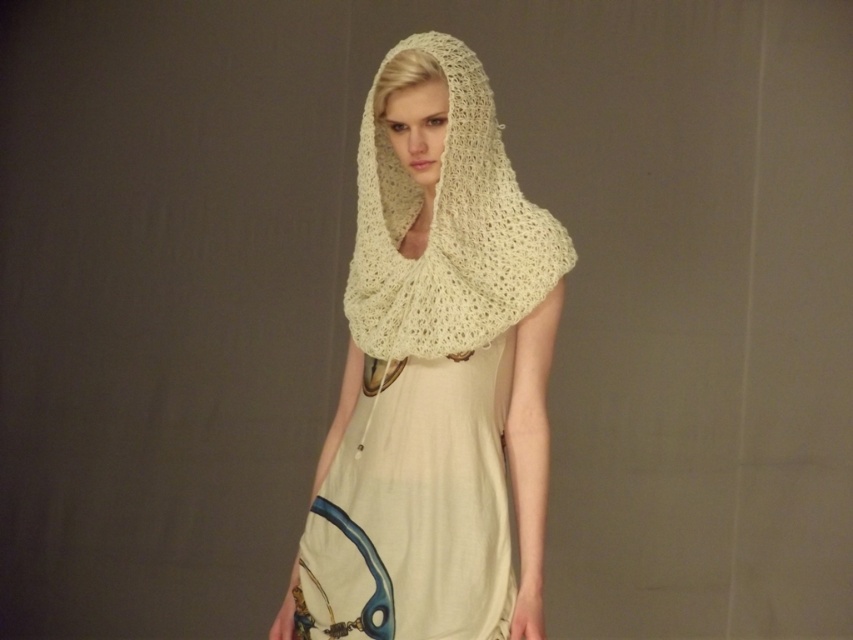
Question: Which object is farther from the camera taking this photo?

Choices:
 (A) ivory knitted shawl at center
 (B) light beige cotton dress at center
 (C) creamy knit shawl at center

Answer: (B)

Question: Can you confirm if ivory knitted shawl at center is bigger than creamy knit shawl at center?

Choices:
 (A) no
 (B) yes

Answer: (B)

Question: Which object is positioned farthest from the ivory knitted shawl at center?

Choices:
 (A) light beige cotton dress at center
 (B) creamy knit shawl at center

Answer: (B)

Question: Can you confirm if ivory knitted shawl at center is positioned below light beige cotton dress at center?

Choices:
 (A) no
 (B) yes

Answer: (A)

Question: Which of the following is the farthest from the observer?

Choices:
 (A) creamy knit shawl at center
 (B) light beige cotton dress at center

Answer: (B)

Question: Can you confirm if light beige cotton dress at center is positioned below creamy knit shawl at center?

Choices:
 (A) no
 (B) yes

Answer: (B)